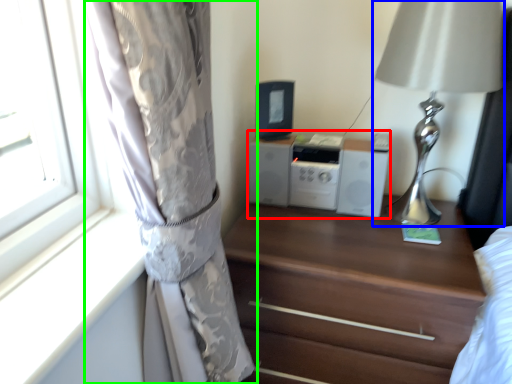
Question: Considering the real-world distances, which object is farthest from stereo (highlighted by a red box)? table lamp (highlighted by a blue box) or curtain (highlighted by a green box)?

Choices:
 (A) table lamp
 (B) curtain

Answer: (B)